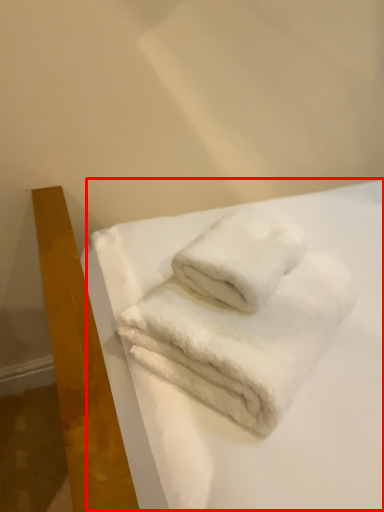
Question: From the image's perspective, where is sheet (annotated by the red box) located relative to towel?

Choices:
 (A) above
 (B) below

Answer: (B)